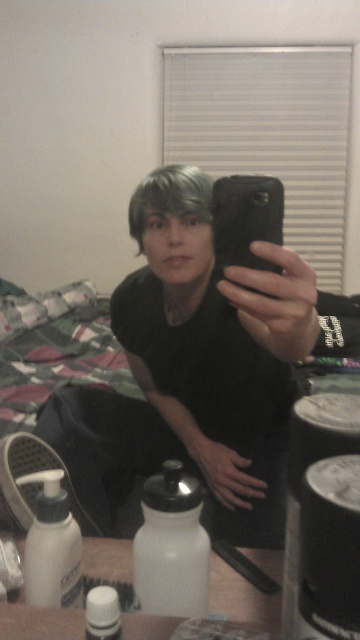
You are organizing items on a shelf and need to place the white matte bottle at center and the white matte water bottle at lower center. Based on their positions in the mirror selfie, which one is closer to the front of the shelf?

The white matte bottle at center is closer to the front of the shelf because the white matte water bottle at lower center is behind it.

You are organizing items on a shelf and see the white matte bottle at center and the white matte water bottle at lower center. Which one is placed to the right of the other?

The white matte bottle at center is positioned on the right side of the white matte water bottle at lower center.

You are a photographer trying to capture a clear shot of the white matte water bottle at lower center without the gray matte hair at center blocking it. How should you adjust your position or angle?

The white matte water bottle at lower center is behind the gray matte hair at center, so you should move the water bottle forward or tilt the camera downward to avoid the hair blocking the view.